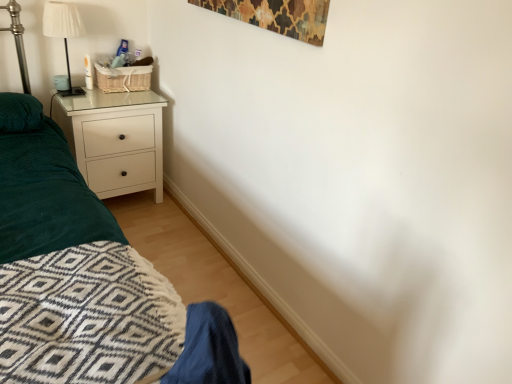
Question: Does white glossy chest of drawers at left have a greater width compared to white pleated fabric lampshade at upper left?

Choices:
 (A) no
 (B) yes

Answer: (B)

Question: From the image's perspective, is white glossy chest of drawers at left above white pleated fabric lampshade at upper left?

Choices:
 (A) no
 (B) yes

Answer: (A)

Question: Is white glossy chest of drawers at left thinner than white pleated fabric lampshade at upper left?

Choices:
 (A) no
 (B) yes

Answer: (A)

Question: Are white glossy chest of drawers at left and white pleated fabric lampshade at upper left beside each other?

Choices:
 (A) no
 (B) yes

Answer: (A)

Question: From a real-world perspective, is white glossy chest of drawers at left on white pleated fabric lampshade at upper left?

Choices:
 (A) no
 (B) yes

Answer: (A)

Question: Does white glossy chest of drawers at left turn towards white pleated fabric lampshade at upper left?

Choices:
 (A) no
 (B) yes

Answer: (A)

Question: Does white pleated fabric lampshade at upper left have a larger size compared to white glossy chest of drawers at left?

Choices:
 (A) yes
 (B) no

Answer: (B)

Question: Is white pleated fabric lampshade at upper left closer to camera compared to white glossy chest of drawers at left?

Choices:
 (A) yes
 (B) no

Answer: (A)

Question: Can you confirm if white pleated fabric lampshade at upper left is wider than white glossy chest of drawers at left?

Choices:
 (A) yes
 (B) no

Answer: (B)

Question: Can you confirm if white pleated fabric lampshade at upper left is positioned to the right of white glossy chest of drawers at left?

Choices:
 (A) yes
 (B) no

Answer: (B)

Question: Does white pleated fabric lampshade at upper left have a smaller size compared to white glossy chest of drawers at left?

Choices:
 (A) yes
 (B) no

Answer: (A)

Question: Is white pleated fabric lampshade at upper left oriented away from white glossy chest of drawers at left?

Choices:
 (A) yes
 (B) no

Answer: (B)

Question: Is white glossy chest of drawers at left to the left or to the right of white pleated fabric lampshade at upper left in the image?

Choices:
 (A) left
 (B) right

Answer: (B)